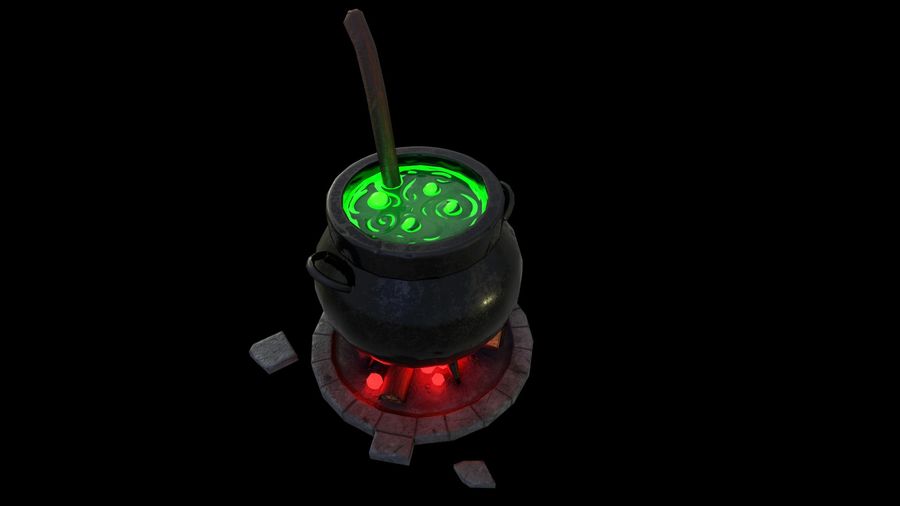
Identify the location of handle. This screenshot has width=900, height=506. (333, 279).